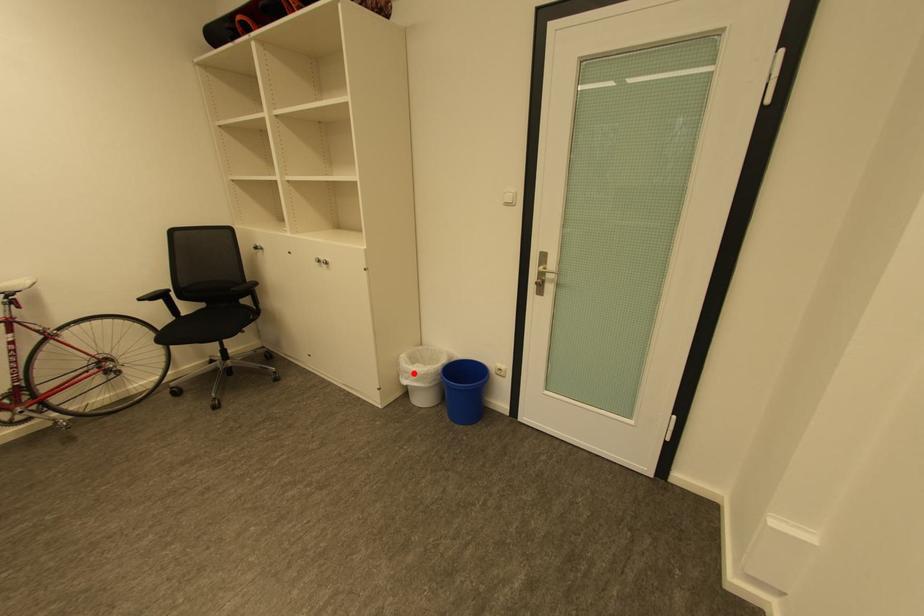
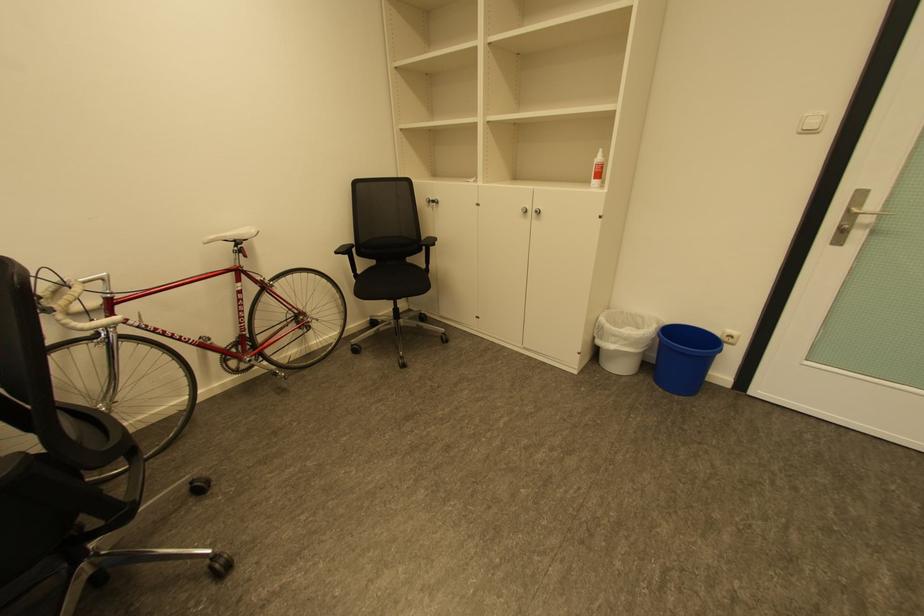
Find the pixel in the second image that matches the highlighted location in the first image.

(622, 337)